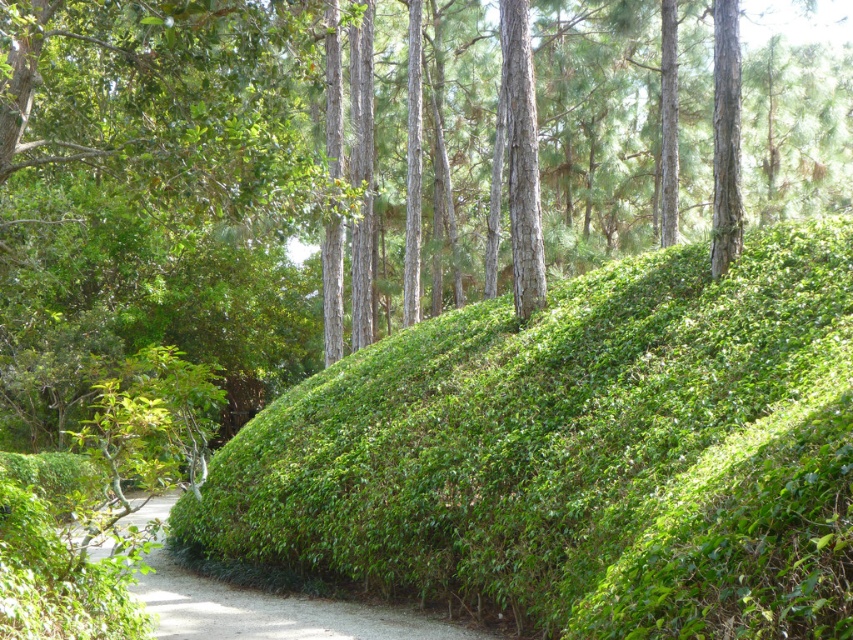
Question: Which point is closer to the camera?

Choices:
 (A) (520, 61)
 (B) (387, 408)

Answer: (B)

Question: Is the position of green leafy hedge at center more distant than that of smooth brown tree trunk at center?

Choices:
 (A) no
 (B) yes

Answer: (A)

Question: Which point is farther from the camera taking this photo?

Choices:
 (A) (224, 540)
 (B) (515, 17)
 (C) (136, 588)

Answer: (B)

Question: Which of the following is the closest to the observer?

Choices:
 (A) green leafy hedge at lower left
 (B) green leafy hedge at center
 (C) smooth brown tree trunk at center

Answer: (B)

Question: Considering the relative positions of green leafy hedge at lower left and smooth brown tree trunk at center in the image provided, where is green leafy hedge at lower left located with respect to smooth brown tree trunk at center?

Choices:
 (A) right
 (B) left

Answer: (B)

Question: Is green leafy hedge at center smaller than smooth brown tree trunk at center?

Choices:
 (A) yes
 (B) no

Answer: (B)